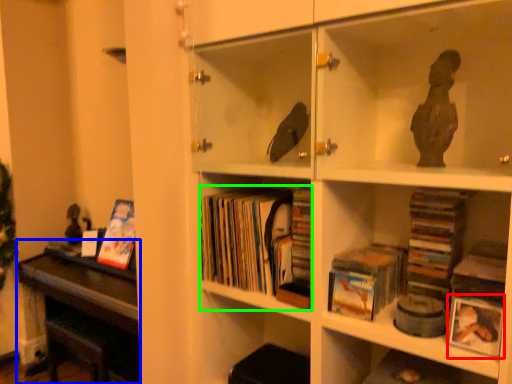
Question: Which is farther away from paperback book (highlighted by a red box)? table (highlighted by a blue box) or book (highlighted by a green box)?

Choices:
 (A) table
 (B) book

Answer: (A)